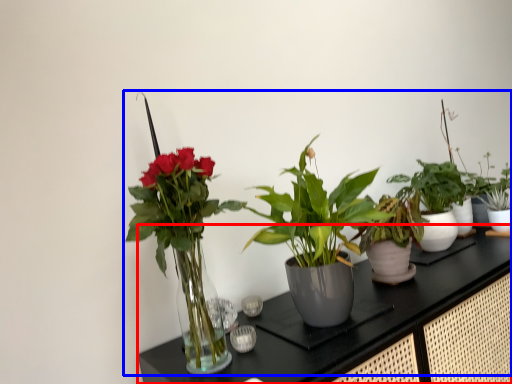
Question: Which object appears farthest to the camera in this image, counter (highlighted by a red box) or houseplant (highlighted by a blue box)?

Choices:
 (A) counter
 (B) houseplant

Answer: (B)